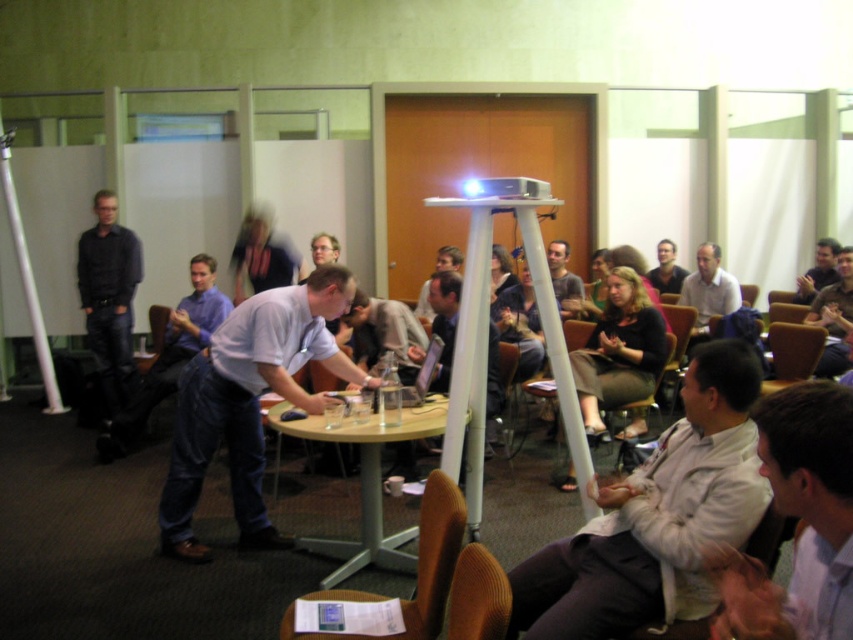
You are a photographer trying to capture a portrait of the man at the conference table. You notice the dark gray shirt at center and the light brown hair at center. Which of these two features will appear taller in the photo?

The light brown hair at center appears taller than the dark gray shirt at center in the photo because the light brown hair at center is taller than the dark gray shirt at center.